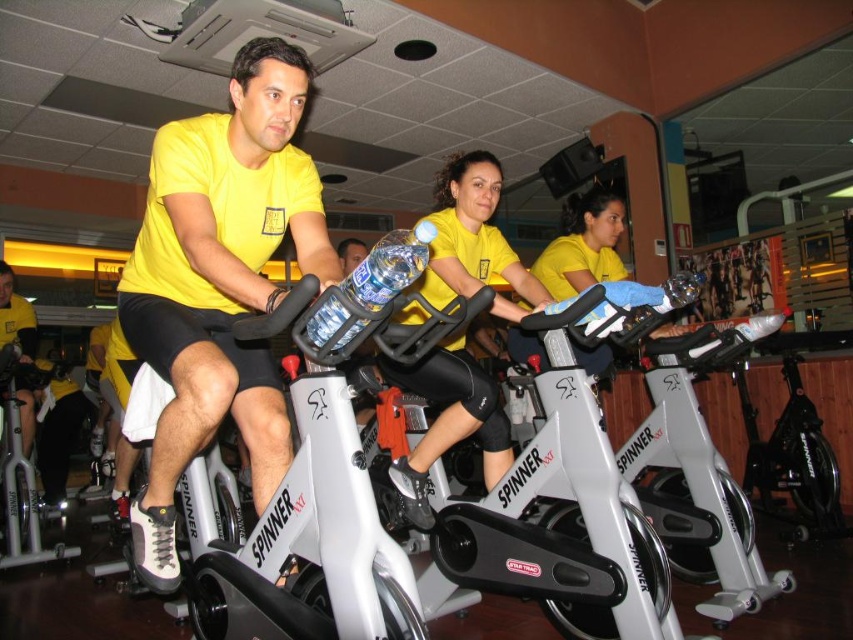
From the picture: You are a participant in the spinning class wearing a matte yellow shirt at center. You notice another participant wearing a yellow matte jersey at center. Which clothing item is wider?

The matte yellow shirt at center is wider than the yellow matte jersey at center.

You are a photographer positioned at the front of the spinning class. You want to take a photo that includes both the point at coordinates point (245, 218) and point (482, 284). Which point should you focus on first to ensure both are in sharp focus?

You should focus on point (245, 218) first because it is closer to the viewer, ensuring both points will be in focus when using a shallow depth of field.